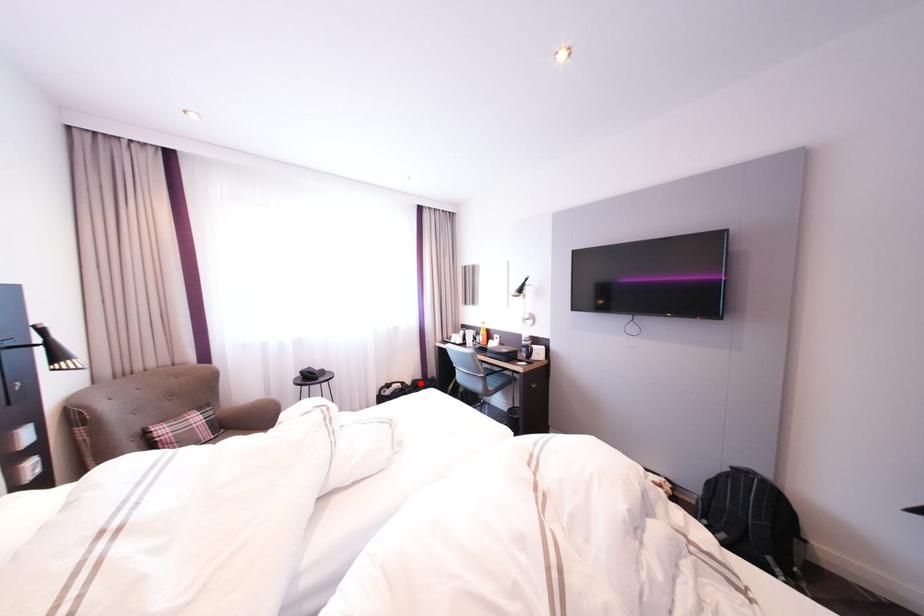
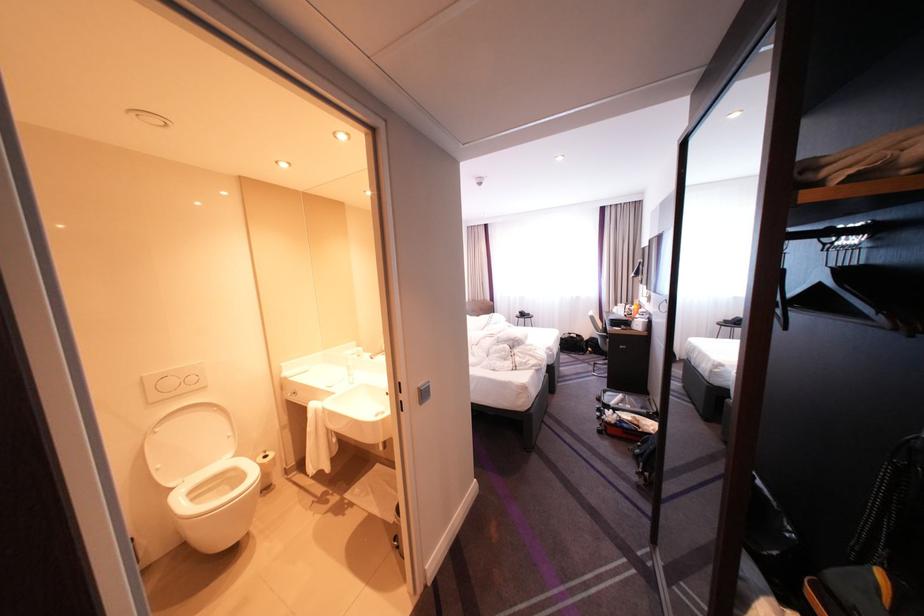
Locate, in the second image, the point that corresponds to the highlighted location in the first image.

(599, 338)